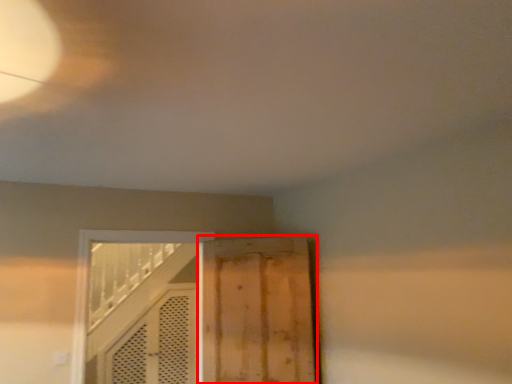
Question: From the image's perspective, what is the correct spatial relationship of door (annotated by the red box) in relation to door?

Choices:
 (A) above
 (B) below

Answer: (A)